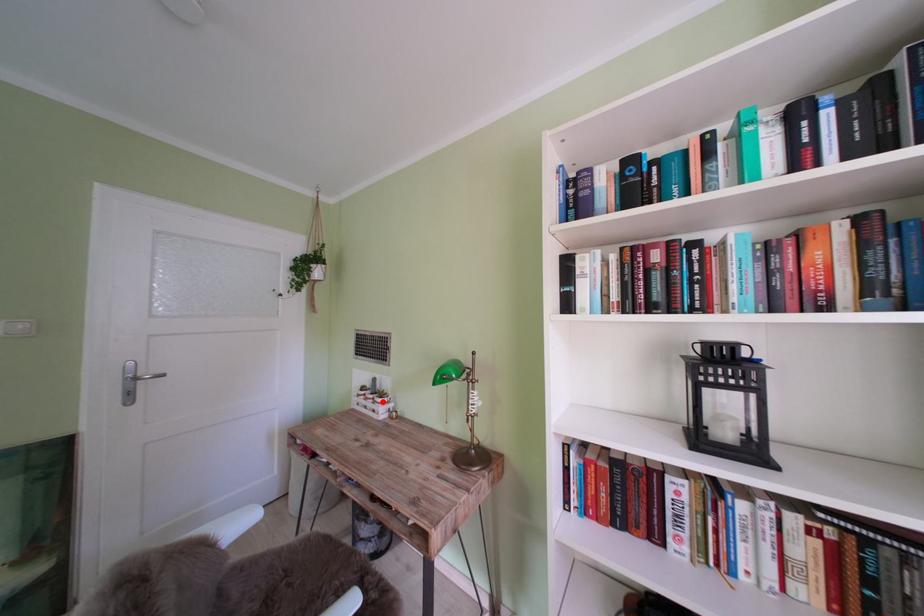
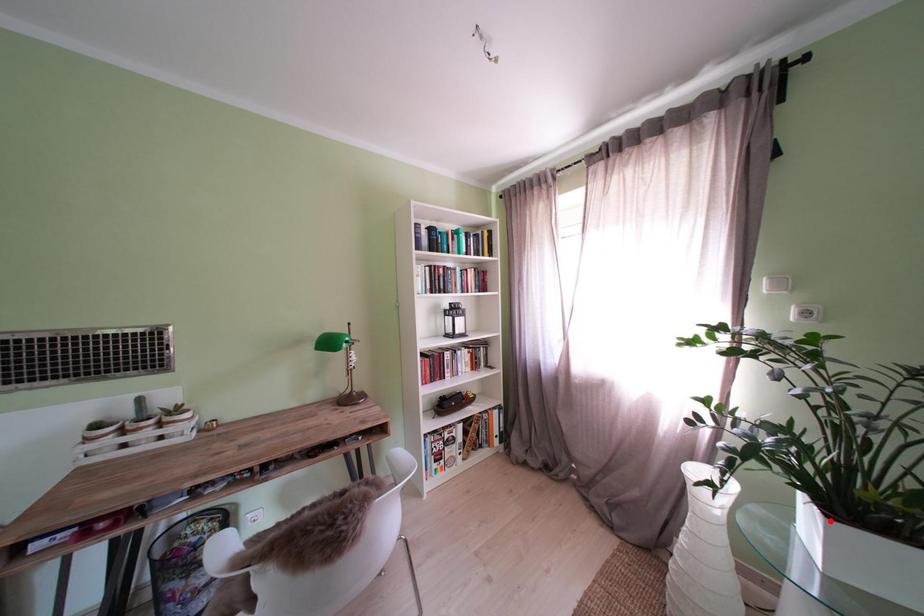
I am providing you with two images of the same scene from different viewpoints. A red point is marked on the first image and another point is marked on the second image. Are the points marked in image1 and image2 representing the same 3D position?

No